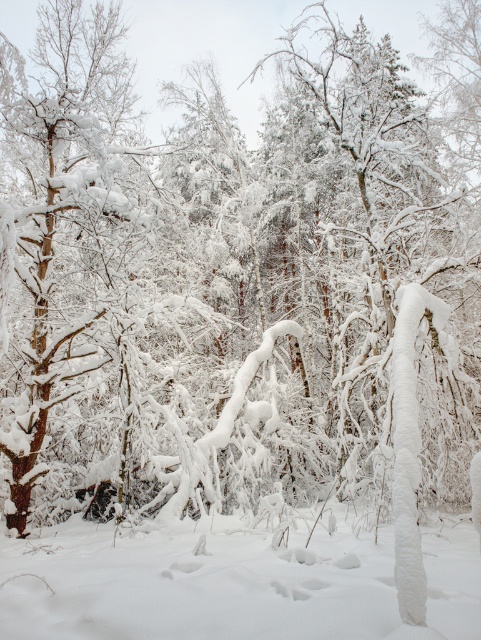
Is white fluffy snow at center shorter than brown rough tree trunk at left?

Correct, white fluffy snow at center is not as tall as brown rough tree trunk at left.

Is point (55, 545) more distant than point (42, 408)?

No, (55, 545) is closer to viewer.

Between point (471, 531) and point (73, 189), which one is positioned in front?

Point (471, 531)

This screenshot has height=640, width=481. Find the location of `white fluffy snow at center`. white fluffy snow at center is located at coordinates click(231, 582).